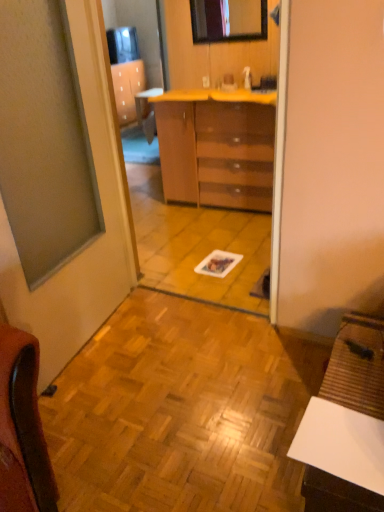
I want to click on free space above white matte desk at lower right (from a real-world perspective), so click(357, 398).